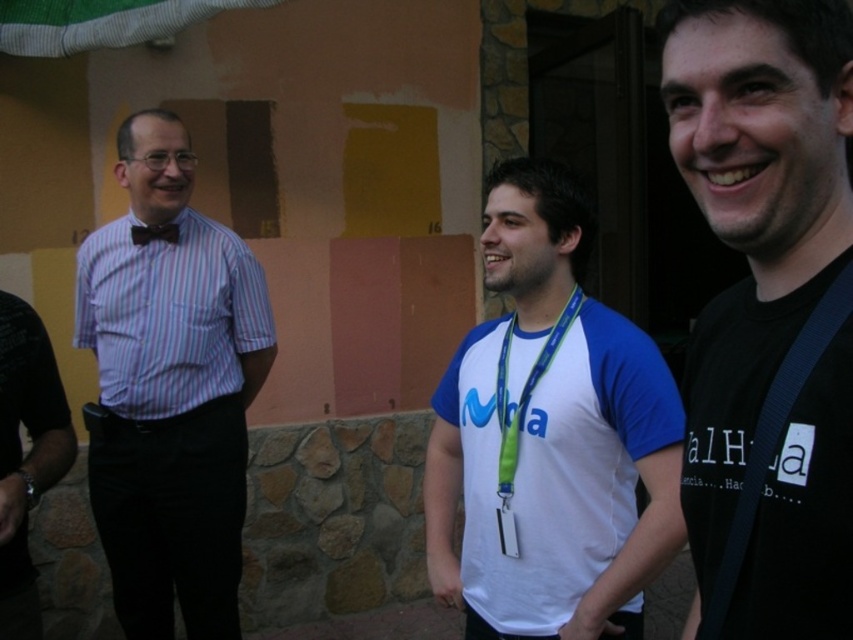
Question: Does white fabric shirt at center appear over striped cotton shirt at left?

Choices:
 (A) yes
 (B) no

Answer: (B)

Question: Where is black matte shirt at center located in relation to purple striped shirt at left in the image?

Choices:
 (A) right
 (B) left

Answer: (A)

Question: Does green fabric lanyard at center have a smaller size compared to white fabric at center?

Choices:
 (A) yes
 (B) no

Answer: (B)

Question: Which is nearer to the striped cotton shirt at left?

Choices:
 (A) white fabric shirt at center
 (B) black matte shirt at center

Answer: (A)

Question: Which object is farther from the camera taking this photo?

Choices:
 (A) green fabric lanyard at center
 (B) black matte shirt at center
 (C) purple striped shirt at left
 (D) white fabric shirt at center

Answer: (C)

Question: Which object appears closest to the camera in this image?

Choices:
 (A) black satin bow tie at center
 (B) black matte shirt at center
 (C) striped cotton shirt at left
 (D) matte striped shirt at left

Answer: (B)